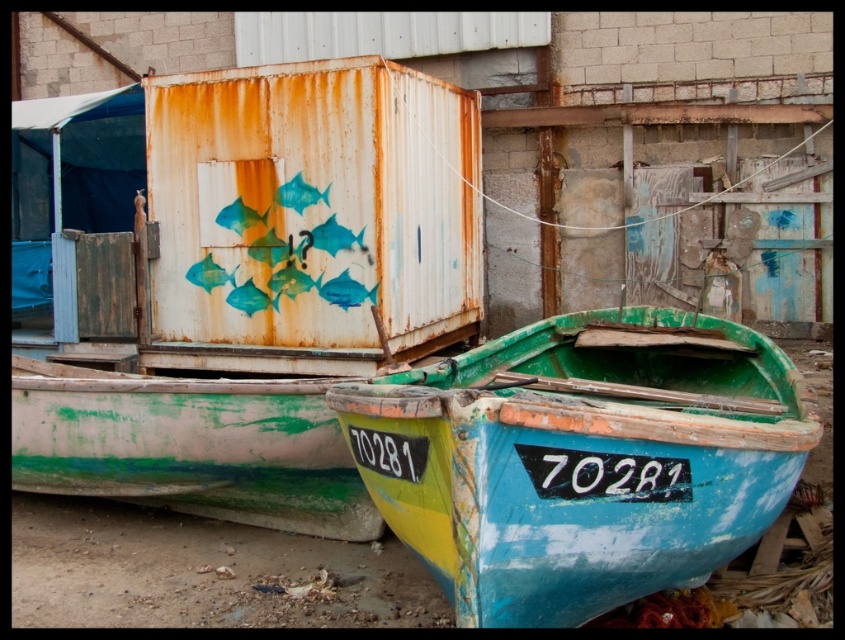
Question: Among these objects, which one is farthest from the camera?

Choices:
 (A) green painted wood boat at center
 (B) rusty metal shipping container at upper center

Answer: (B)

Question: Can you confirm if green painted wood boat at center is positioned to the left of rusty metal shipping container at upper center?

Choices:
 (A) yes
 (B) no

Answer: (B)

Question: Can you confirm if green painted wood boat at center is positioned above rusty metal shipping container at upper center?

Choices:
 (A) no
 (B) yes

Answer: (A)

Question: Is green painted wood boat at center to the right of rusty metal shipping container at upper center from the viewer's perspective?

Choices:
 (A) no
 (B) yes

Answer: (B)

Question: Among these objects, which one is farthest from the camera?

Choices:
 (A) green painted wood boat at center
 (B) rusty metal shipping container at upper center

Answer: (B)